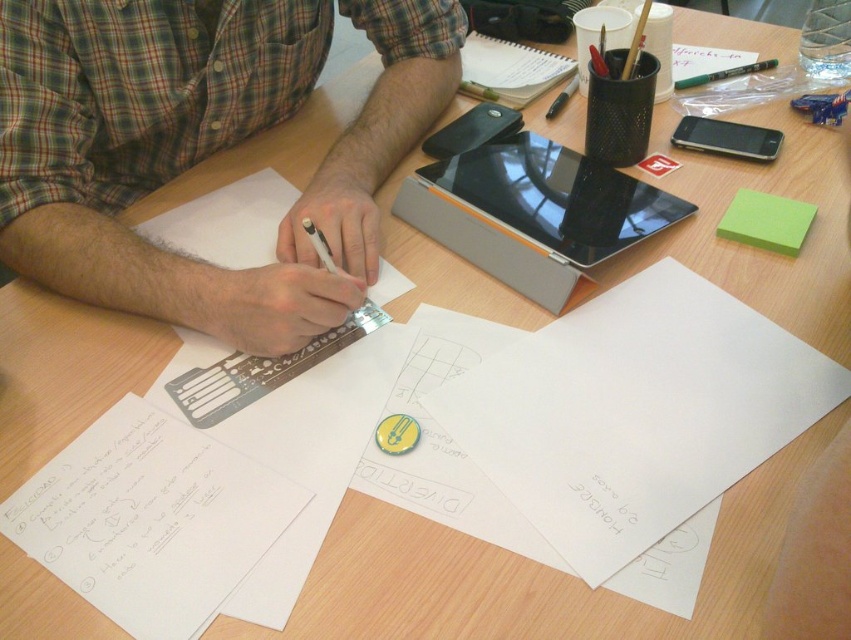
What are the coordinates of the green plaid shirt at upper left?

The green plaid shirt at upper left is located at coordinates point [280,221].

You are looking at the scene and notice the green plaid shirt at upper left and the white paper at lower left. Which object is positioned more to the left side of the table?

The white paper at lower left is more to the left side of the table since the green plaid shirt at upper left is to the right of it.

What is located at the coordinates point (150,518)?

The white paper at lower left is located at point (150,518).